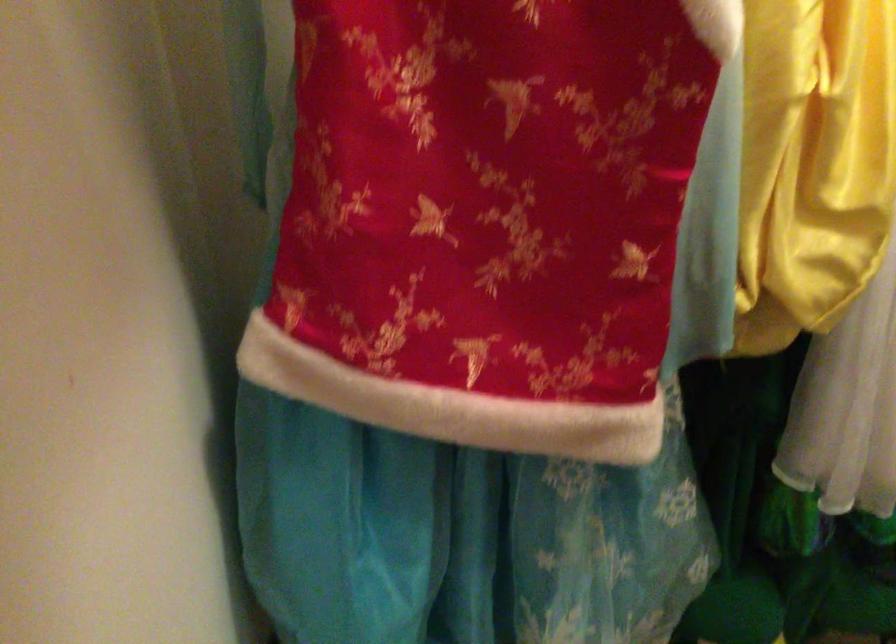
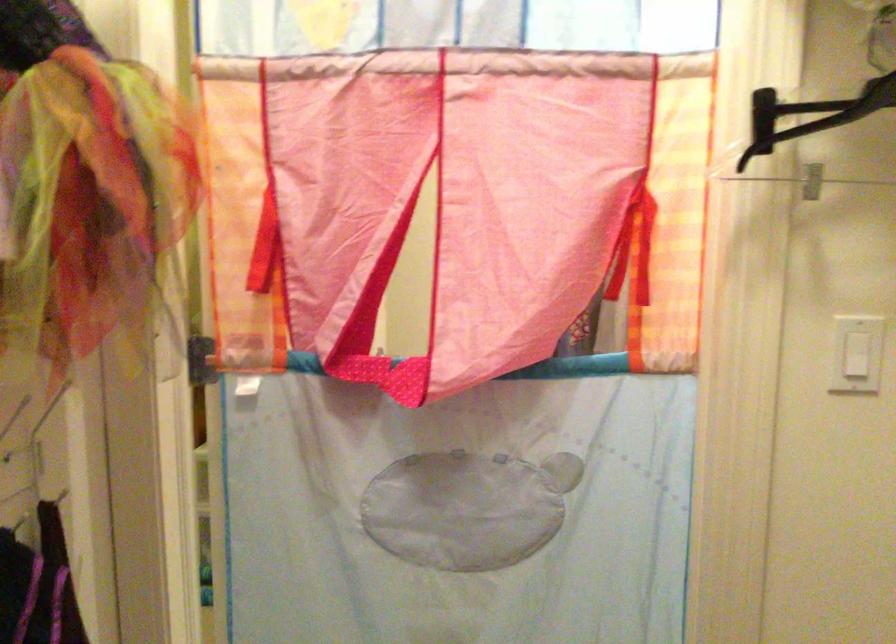
Question: The images are taken continuously from a first-person perspective. In which direction is your viewpoint rotating?

Choices:
 (A) Left
 (B) Right
 (C) Up
 (D) Down

Answer: (B)